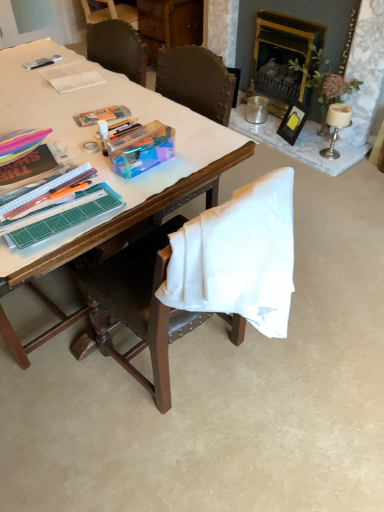
Locate an element on the screen. vacant area on top of gold-framed fireplace at upper right (from a real-world perspective) is located at coordinates (299, 15).